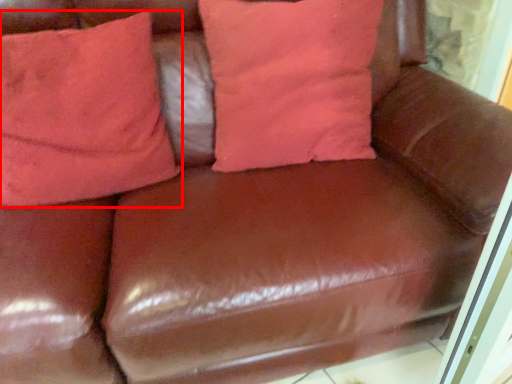
Question: From the image's perspective, what is the correct spatial positioning of pillow (annotated by the red box) in reference to pillow?

Choices:
 (A) above
 (B) below

Answer: (B)